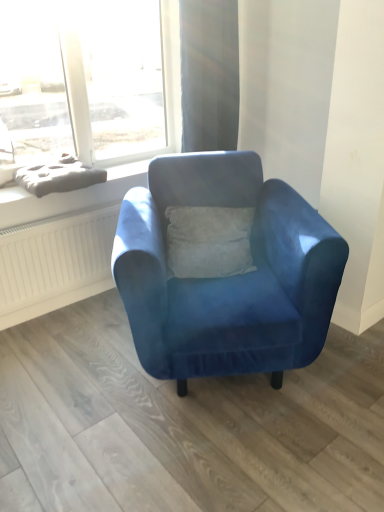
Question: Is satin beige curtain at upper center closer to the viewer compared to matte gray cushion at upper left?

Choices:
 (A) no
 (B) yes

Answer: (A)

Question: Does satin beige curtain at upper center have a greater height compared to matte gray cushion at upper left?

Choices:
 (A) yes
 (B) no

Answer: (A)

Question: Are satin beige curtain at upper center and matte gray cushion at upper left making contact?

Choices:
 (A) no
 (B) yes

Answer: (A)

Question: Is satin beige curtain at upper center not within matte gray cushion at upper left?

Choices:
 (A) no
 (B) yes

Answer: (B)

Question: Is satin beige curtain at upper center oriented towards matte gray cushion at upper left?

Choices:
 (A) yes
 (B) no

Answer: (B)

Question: In terms of size, does matte gray cushion at upper left appear bigger or smaller than velvet blue armchair at center?

Choices:
 (A) small
 (B) big

Answer: (A)

Question: Is point (61, 179) closer or farther from the camera than point (246, 179)?

Choices:
 (A) closer
 (B) farther

Answer: (B)

Question: Considering their positions, is matte gray cushion at upper left located in front of or behind velvet blue armchair at center?

Choices:
 (A) front
 (B) behind

Answer: (B)

Question: Is matte gray cushion at upper left inside the boundaries of velvet blue armchair at center, or outside?

Choices:
 (A) outside
 (B) inside

Answer: (A)

Question: From a real-world perspective, is satin beige curtain at upper center physically located above or below gray fabric cushion at upper left?

Choices:
 (A) above
 (B) below

Answer: (A)

Question: From the image's perspective, is satin beige curtain at upper center above or below gray fabric cushion at upper left?

Choices:
 (A) above
 (B) below

Answer: (A)

Question: In terms of size, does satin beige curtain at upper center appear bigger or smaller than gray fabric cushion at upper left?

Choices:
 (A) small
 (B) big

Answer: (B)

Question: Is point (218, 13) closer or farther from the camera than point (8, 220)?

Choices:
 (A) farther
 (B) closer

Answer: (A)

Question: In terms of height, does gray fabric cushion at upper left look taller or shorter compared to matte gray cushion at upper left?

Choices:
 (A) short
 (B) tall

Answer: (A)

Question: Would you say gray fabric cushion at upper left is to the left or to the right of matte gray cushion at upper left in the picture?

Choices:
 (A) right
 (B) left

Answer: (A)